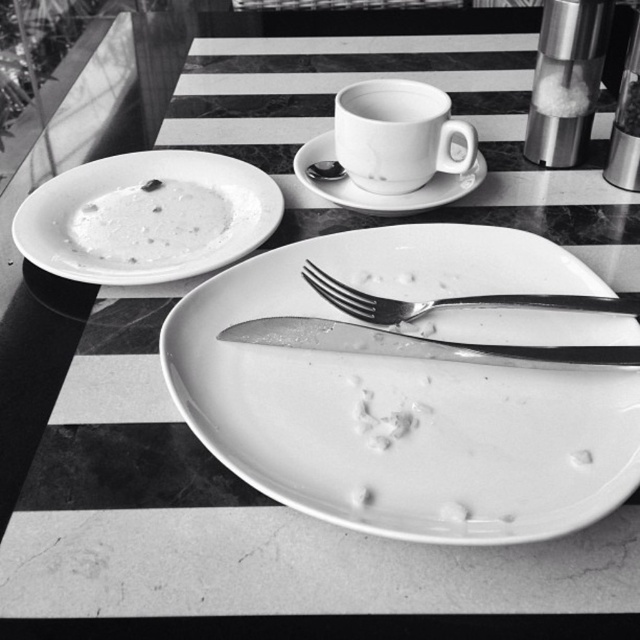
Question: Does polished silver fork at center have a smaller size compared to metallic silver pepper grinder at upper right?

Choices:
 (A) yes
 (B) no

Answer: (B)

Question: Is white creamy soup at upper left thinner than polished silver fork at center?

Choices:
 (A) no
 (B) yes

Answer: (B)

Question: Which object appears closest to the camera in this image?

Choices:
 (A) white ceramic mug at upper center
 (B) white creamy soup at upper left
 (C) white matte plate at center
 (D) shiny silver knife at center

Answer: (D)

Question: Which object appears closest to the camera in this image?

Choices:
 (A) white creamy soup at upper left
 (B) shiny silver knife at center
 (C) shiny metal spoon at upper center
 (D) white glossy plate at center

Answer: (D)

Question: Does shiny silver knife at center have a larger size compared to white matte plate at center?

Choices:
 (A) yes
 (B) no

Answer: (B)

Question: Among these objects, which one is farthest from the camera?

Choices:
 (A) metallic silver pepper grinder at upper right
 (B) shiny silver knife at center

Answer: (A)